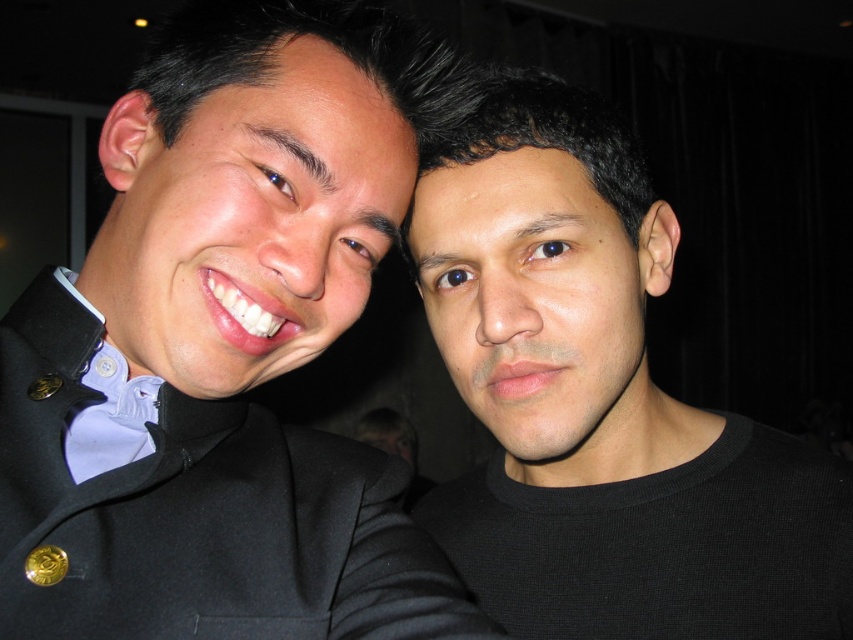
You are a photographer trying to adjust the lighting for a portrait. You notice the black matte suit at left and the black matte shirt at right in the frame. Which object is positioned higher in the image?

The black matte suit at left is located above the black matte shirt at right, so it is positioned higher in the image.

You are a photographer trying to adjust the lighting for a portrait. You notice the black matte suit at left is positioned at point (224, 348). Where should you place the key light to ensure it illuminates the black matte suit at left effectively?

The key light should be placed in a position that directly faces the black matte suit at left located at point (224, 348) to ensure proper illumination, as positioning the light opposite to the subject might cast shadows or leave areas underexposed.